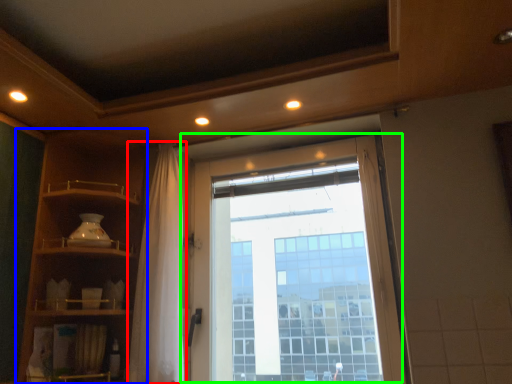
Question: Estimate the real-world distances between objects in this image. Which object is closer to shower curtain (highlighted by a red box), shelf (highlighted by a blue box) or window (highlighted by a green box)?

Choices:
 (A) shelf
 (B) window

Answer: (A)